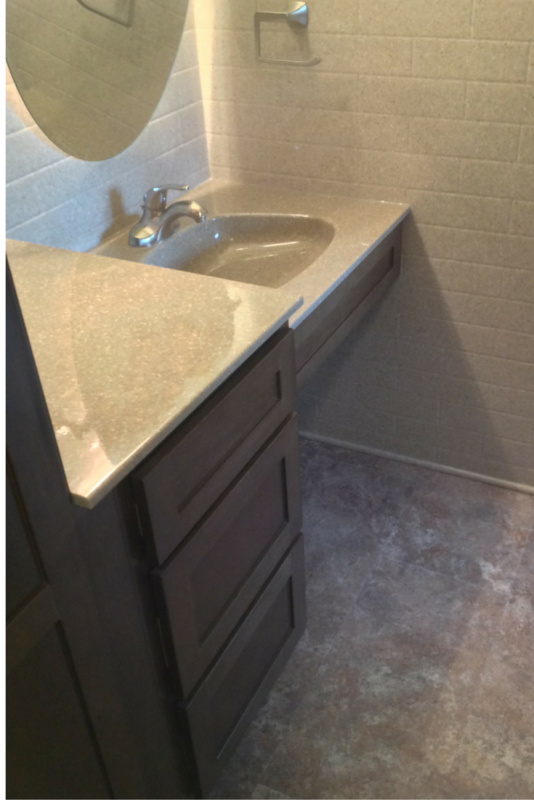
This screenshot has width=534, height=800. Identify the location of faucet. (156, 230).